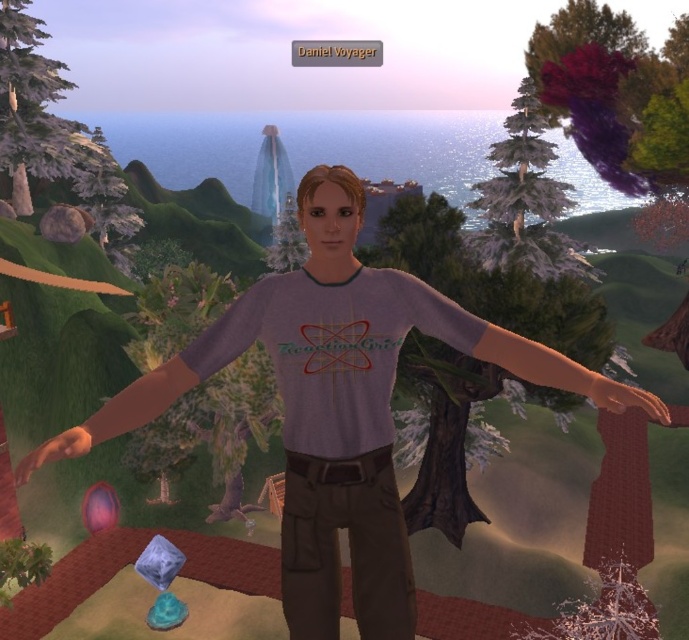
Is green matte tree at upper left above green matte tree at center?

Yes, green matte tree at upper left is above green matte tree at center.

Is point (105, 164) farther from viewer compared to point (291, 211)?

Yes.

Locate an element on the screen. The height and width of the screenshot is (640, 689). green matte tree at upper left is located at coordinates (105, 196).

Is point (25, 209) positioned behind point (110, 241)?

That is False.

Is green matte tree at left positioned behind green matte tree at upper left?

No, green matte tree at left is in front of green matte tree at upper left.

The width and height of the screenshot is (689, 640). In order to click on green matte tree at left in this screenshot , I will do `click(54, 136)`.

Can you confirm if green matte tree at left is shorter than snowy bark tree at lower right?

No, green matte tree at left is not shorter than snowy bark tree at lower right.

Who is more forward, [0,72] or [610,600]?

Point [610,600] is more forward.

Where is `green matte tree at left`? This screenshot has width=689, height=640. green matte tree at left is located at coordinates (54, 136).